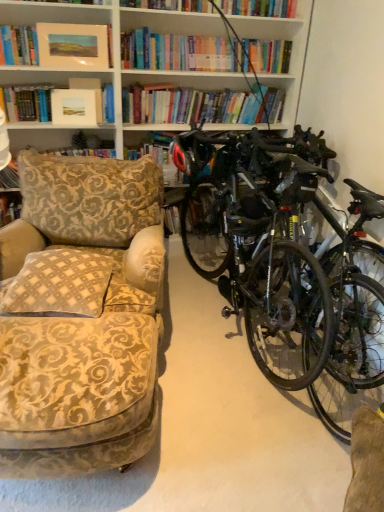
Question: Should I look upward or downward to see matte white picture frame at upper center?

Choices:
 (A) down
 (B) up

Answer: (B)

Question: From the image's perspective, is shiny black bicycle at right above matte oil painting at upper left, arranged as the 1th book when viewed from the top?

Choices:
 (A) yes
 (B) no

Answer: (B)

Question: Can you confirm if shiny black bicycle at right is positioned to the right of matte oil painting at upper left, placed as the 1th book when sorted from front to back?

Choices:
 (A) yes
 (B) no

Answer: (A)

Question: From a real-world perspective, is shiny black bicycle at right located beneath matte oil painting at upper left, the 2th book positioned from the back?

Choices:
 (A) no
 (B) yes

Answer: (B)

Question: Considering the relative sizes of shiny black bicycle at right and matte oil painting at upper left, positioned as the 2th book in bottom-to-top order, in the image provided, is shiny black bicycle at right shorter than matte oil painting at upper left, positioned as the 2th book in bottom-to-top order,?

Choices:
 (A) no
 (B) yes

Answer: (A)

Question: Can you confirm if shiny black bicycle at right is bigger than matte oil painting at upper left, placed as the 1th book when sorted from front to back?

Choices:
 (A) no
 (B) yes

Answer: (B)

Question: Is shiny black bicycle at right to the left of matte oil painting at upper left, positioned as the 2th book in bottom-to-top order, from the viewer's perspective?

Choices:
 (A) yes
 (B) no

Answer: (B)

Question: Is matte black helmet at center not near patterned fabric cushion at left, the 2th book when ordered from front to back?

Choices:
 (A) yes
 (B) no

Answer: (B)

Question: Considering the relative positions of matte black helmet at center and patterned fabric cushion at left, which ranks as the first book in back-to-front order, in the image provided, is matte black helmet at center to the left of patterned fabric cushion at left, which ranks as the first book in back-to-front order, from the viewer's perspective?

Choices:
 (A) yes
 (B) no

Answer: (B)

Question: Is matte black helmet at center closer to camera compared to patterned fabric cushion at left, which appears as the first book when ordered from the bottom?

Choices:
 (A) no
 (B) yes

Answer: (B)

Question: Is matte black helmet at center thinner than patterned fabric cushion at left, which ranks as the first book in back-to-front order?

Choices:
 (A) yes
 (B) no

Answer: (A)

Question: Is matte black helmet at center bigger than patterned fabric cushion at left, which appears as the first book when ordered from the bottom?

Choices:
 (A) yes
 (B) no

Answer: (B)

Question: Can you see matte black helmet at center touching patterned fabric cushion at left, which appears as the first book when ordered from the bottom?

Choices:
 (A) no
 (B) yes

Answer: (A)

Question: Is beige checkered pillow at left turned away from matte white picture frame at upper center?

Choices:
 (A) no
 (B) yes

Answer: (A)